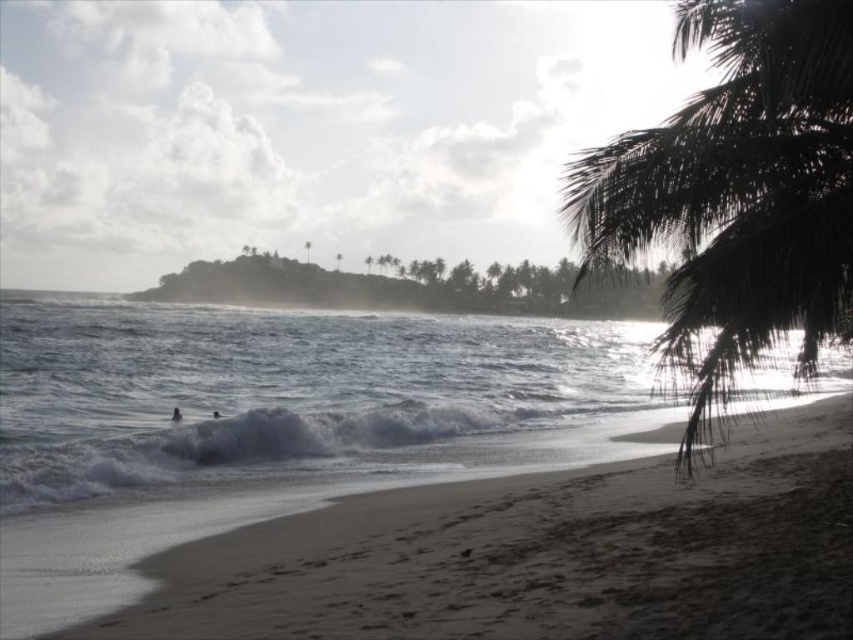
Does dark green leafy palm tree at right have a greater width compared to dark skin person at lower left?

Yes.

The image size is (853, 640). What are the coordinates of `dark green leafy palm tree at right` in the screenshot? It's located at (738, 192).

Based on the photo, which is more to the left, white frothy water at lower left or dark skin person at lower left?

dark skin person at lower left is more to the left.

Is white frothy water at lower left to the right of dark skin person at lower left from the viewer's perspective?

Yes, white frothy water at lower left is to the right of dark skin person at lower left.

This screenshot has width=853, height=640. What are the coordinates of `white frothy water at lower left` in the screenshot? It's located at (294, 396).

Identify the location of white frothy water at lower left. This screenshot has width=853, height=640. click(294, 396).

How distant is dark green leafy palm tree at right from green leafy palm tree at center?

dark green leafy palm tree at right is 158.20 meters from green leafy palm tree at center.

The height and width of the screenshot is (640, 853). I want to click on dark green leafy palm tree at right, so click(738, 192).